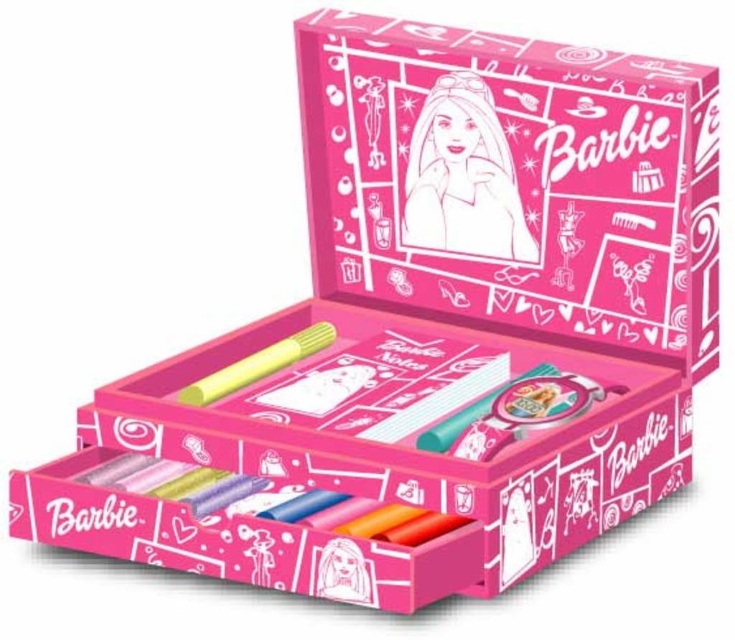
Question: Is pink paper doll at center positioned in front of yellow matte crayon at center?

Choices:
 (A) yes
 (B) no

Answer: (B)

Question: Which point appears closest to the camera in this image?

Choices:
 (A) (430, 180)
 (B) (270, 355)

Answer: (B)

Question: Is pink paper doll at center wider than yellow matte crayon at center?

Choices:
 (A) no
 (B) yes

Answer: (A)

Question: Is pink paper doll at center smaller than yellow matte crayon at center?

Choices:
 (A) no
 (B) yes

Answer: (A)

Question: Which of the following is the closest to the observer?

Choices:
 (A) click(x=423, y=240)
 (B) click(x=322, y=342)

Answer: (B)

Question: Which point is closer to the camera?

Choices:
 (A) pink paper doll at center
 (B) yellow matte crayon at center

Answer: (B)